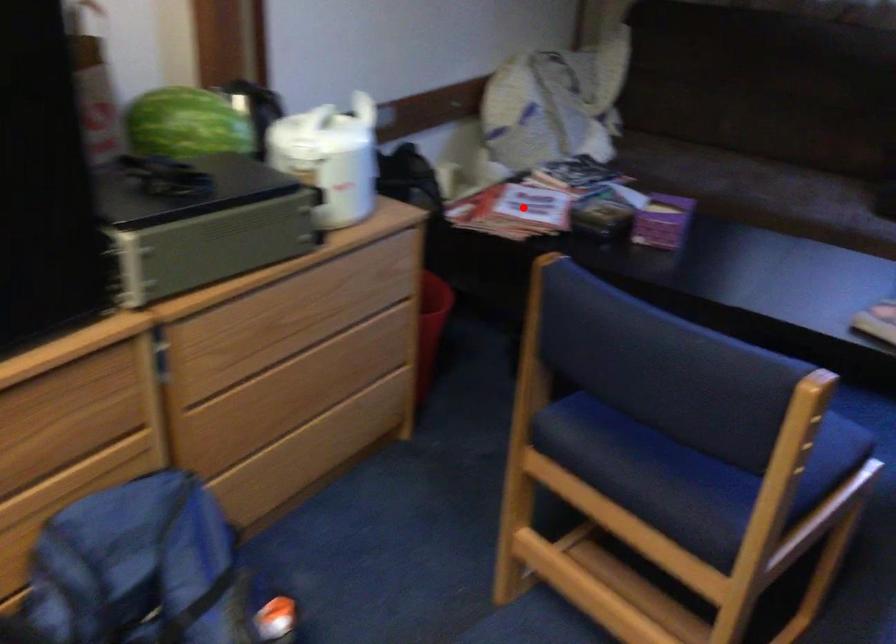
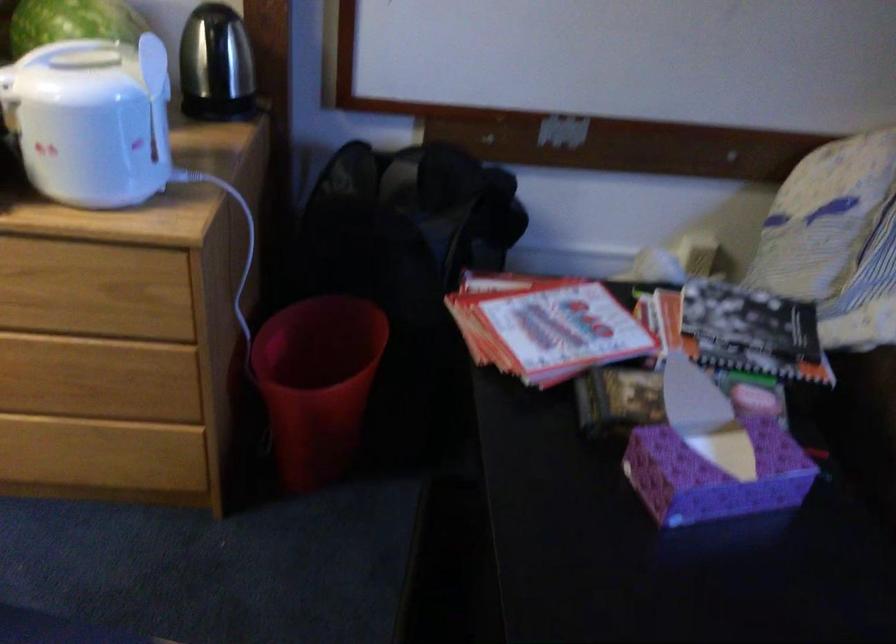
Question: A red point is marked in image1. In image2, is the corresponding 3D point closer to the camera or farther? Reply with the corresponding letter.

Choices:
 (A) The corresponding 3D point is closer.
 (B) The corresponding 3D point is farther.

Answer: (A)